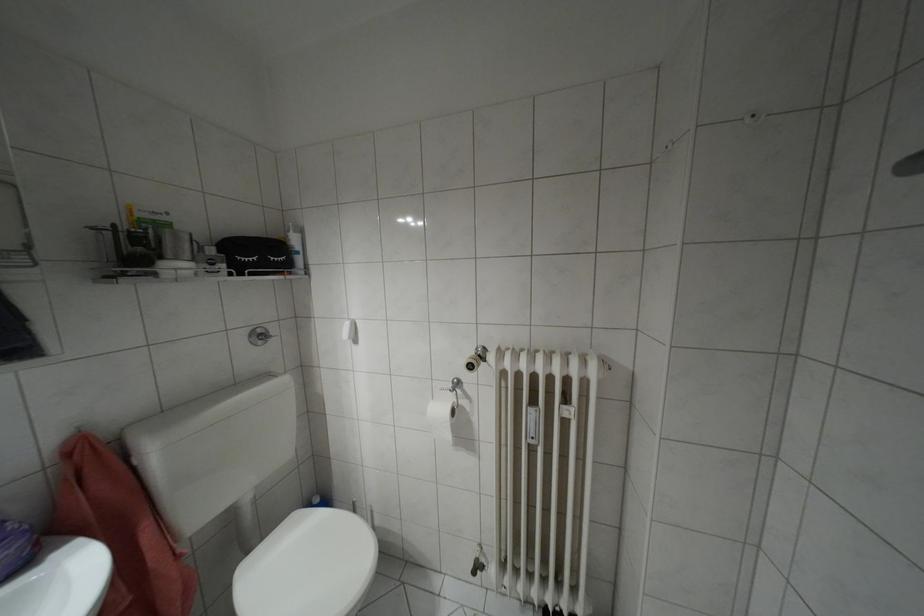
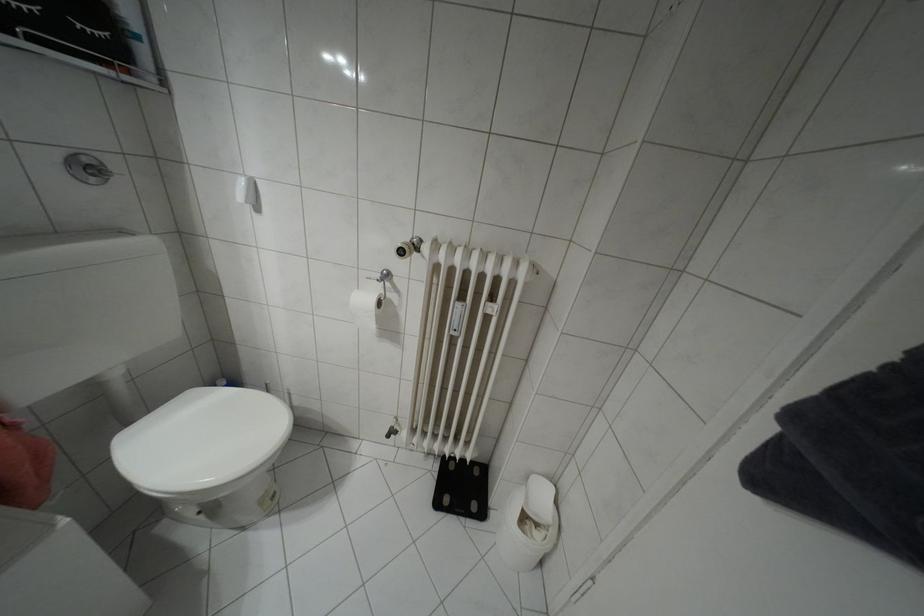
What movement of the cameraman would produce the second image?

The movement direction of the cameraman is right, forward.